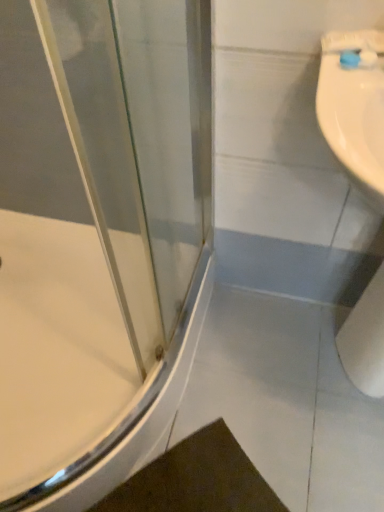
Question: Is blue plastic toothbrush at upper right looking in the opposite direction of white glossy bathtub at left?

Choices:
 (A) yes
 (B) no

Answer: (B)

Question: Are blue plastic toothbrush at upper right and white glossy bathtub at left far apart?

Choices:
 (A) no
 (B) yes

Answer: (A)

Question: Does blue plastic toothbrush at upper right have a lesser width compared to white glossy bathtub at left?

Choices:
 (A) no
 (B) yes

Answer: (B)

Question: Does blue plastic toothbrush at upper right have a greater width compared to white glossy bathtub at left?

Choices:
 (A) yes
 (B) no

Answer: (B)

Question: From a real-world perspective, is blue plastic toothbrush at upper right on top of white glossy bathtub at left?

Choices:
 (A) no
 (B) yes

Answer: (B)

Question: Is blue plastic toothbrush at upper right positioned before white glossy bathtub at left?

Choices:
 (A) yes
 (B) no

Answer: (A)

Question: Is white glossy bathtub at left facing away from blue plastic toothbrush at upper right?

Choices:
 (A) yes
 (B) no

Answer: (B)

Question: Is white glossy bathtub at left located outside blue plastic toothbrush at upper right?

Choices:
 (A) no
 (B) yes

Answer: (B)

Question: Can you confirm if white glossy bathtub at left is shorter than blue plastic toothbrush at upper right?

Choices:
 (A) no
 (B) yes

Answer: (A)

Question: Can you confirm if white glossy bathtub at left is positioned to the right of blue plastic toothbrush at upper right?

Choices:
 (A) no
 (B) yes

Answer: (A)

Question: Would you consider white glossy bathtub at left to be distant from blue plastic toothbrush at upper right?

Choices:
 (A) yes
 (B) no

Answer: (B)

Question: Considering the relative sizes of white glossy bathtub at left and blue plastic toothbrush at upper right in the image provided, is white glossy bathtub at left taller than blue plastic toothbrush at upper right?

Choices:
 (A) no
 (B) yes

Answer: (B)

Question: Can you confirm if white matte toilet paper at lower right is smaller than blue plastic toothbrush at upper right?

Choices:
 (A) no
 (B) yes

Answer: (A)